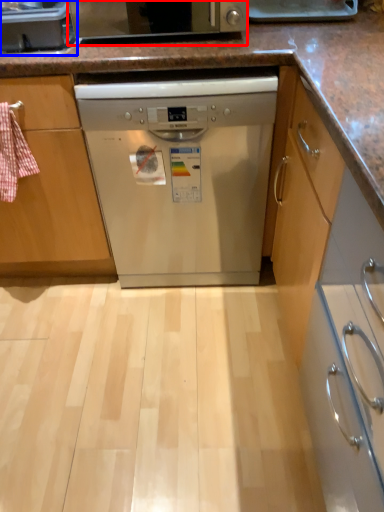
Question: Which object is further to the camera taking this photo, home appliance (highlighted by a red box) or kitchen appliance (highlighted by a blue box)?

Choices:
 (A) home appliance
 (B) kitchen appliance

Answer: (B)